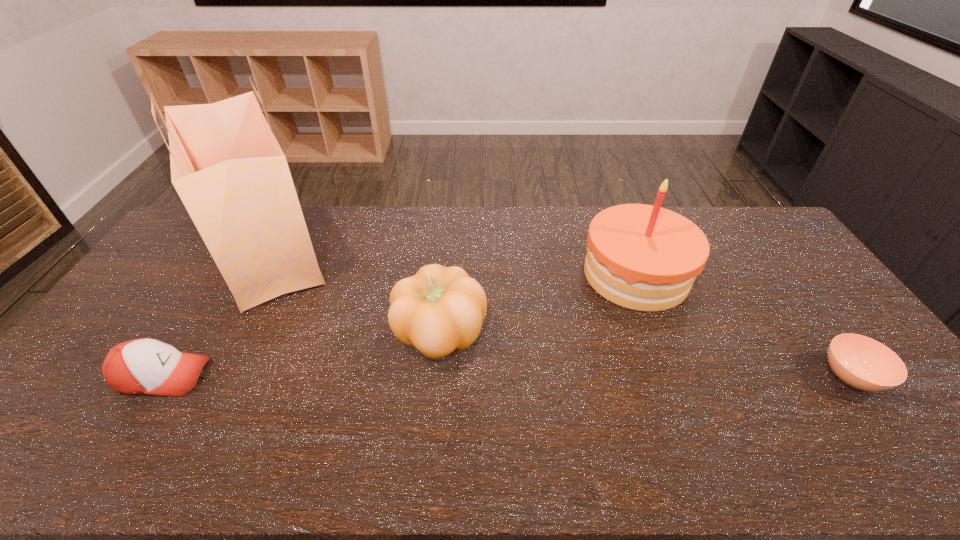
Locate an element on the screen. The width and height of the screenshot is (960, 540). unoccupied position between the third object from right to left and the grocery bag is located at coordinates (355, 293).

Find the location of a particular element. Image resolution: width=960 pixels, height=540 pixels. unoccupied position between the grocery bag and the fourth tallest object is located at coordinates (217, 315).

Where is `free space between the tallest object and the third shortest object`? free space between the tallest object and the third shortest object is located at coordinates (355, 293).

Identify the location of unoccupied area between the grocery bag and the birthday cake. [x=453, y=264].

Locate which object ranks second in proximity to the soup bowl. Please provide its 2D coordinates. Your answer should be formatted as a tuple, i.e. [(x, y)], where the tuple contains the x and y coordinates of a point satisfying the conditions above.

[(439, 309)]

Identify which object is located as the second nearest to the birthday cake. Please provide its 2D coordinates. Your answer should be formatted as a tuple, i.e. [(x, y)], where the tuple contains the x and y coordinates of a point satisfying the conditions above.

[(439, 309)]

Find the location of a particular element. This screenshot has width=960, height=540. blank area in the image that satisfies the following two spatial constraints: 1. on the side of the grocery bag with the superhero design; 2. on the right side of the rightmost object is located at coordinates (204, 377).

Image resolution: width=960 pixels, height=540 pixels. I want to click on free location that satisfies the following two spatial constraints: 1. on the side of the third object from right to left with the superhero design; 2. on the right side of the tallest object, so click(x=228, y=333).

This screenshot has height=540, width=960. Find the location of `free point that satisfies the following two spatial constraints: 1. on the back side of the rightmost object; 2. on the side of the grocery bag with the superhero design`. free point that satisfies the following two spatial constraints: 1. on the back side of the rightmost object; 2. on the side of the grocery bag with the superhero design is located at coordinates (762, 254).

The width and height of the screenshot is (960, 540). Find the location of `free space that satisfies the following two spatial constraints: 1. on the front side of the rightmost object; 2. on the left side of the pumpkin`. free space that satisfies the following two spatial constraints: 1. on the front side of the rightmost object; 2. on the left side of the pumpkin is located at coordinates pyautogui.click(x=436, y=377).